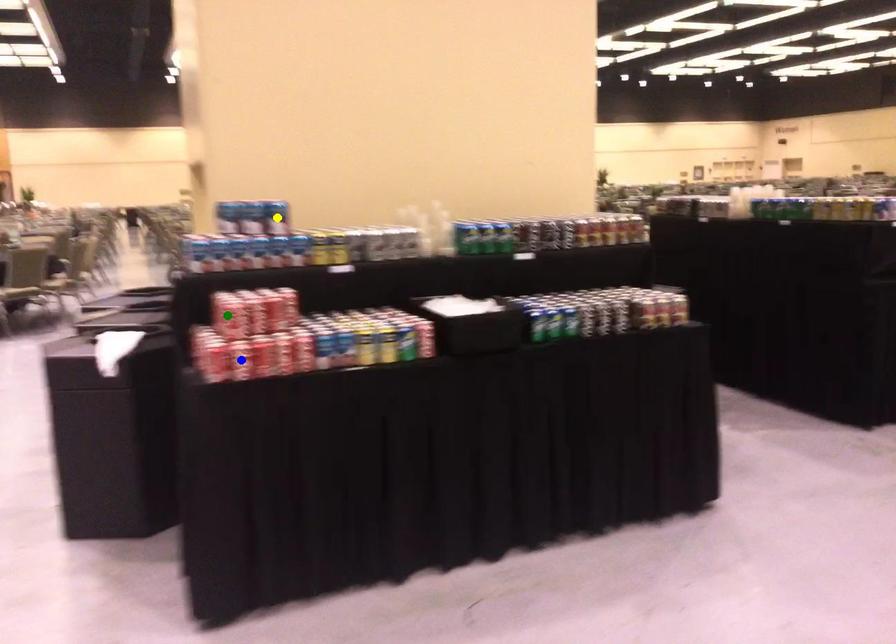
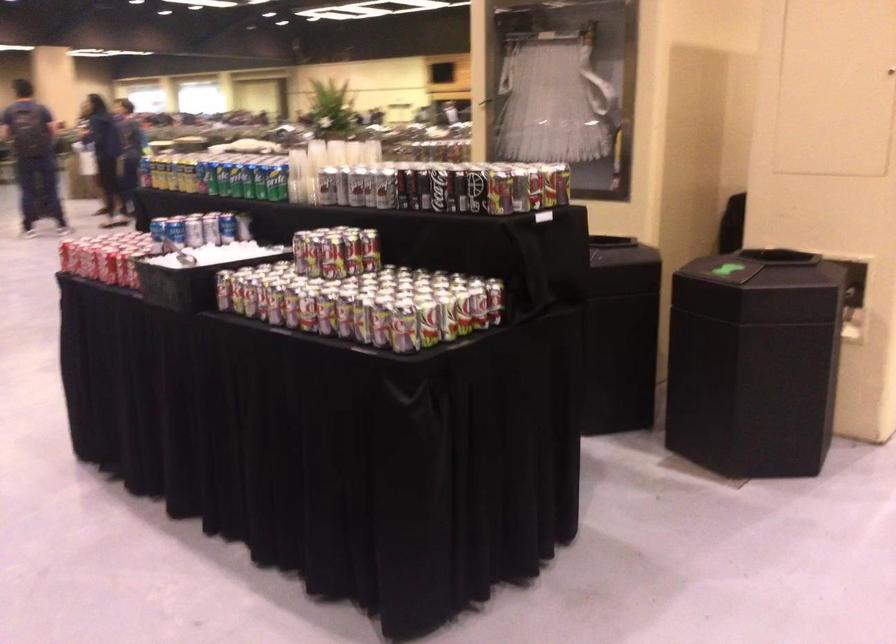
I am providing you with two images of the same scene from different viewpoints. Three points are marked in image1. Which point corresponds to a part or object that is occluded in image2?In image1, three points are marked. Which of them correspond to a part or object that is occluded in image2?Among the three points shown in image1, which one corresponds to a part or object that is no longer visible due to occlusion in image2?

yellow point, blue point, green point cannot be seen in image2.